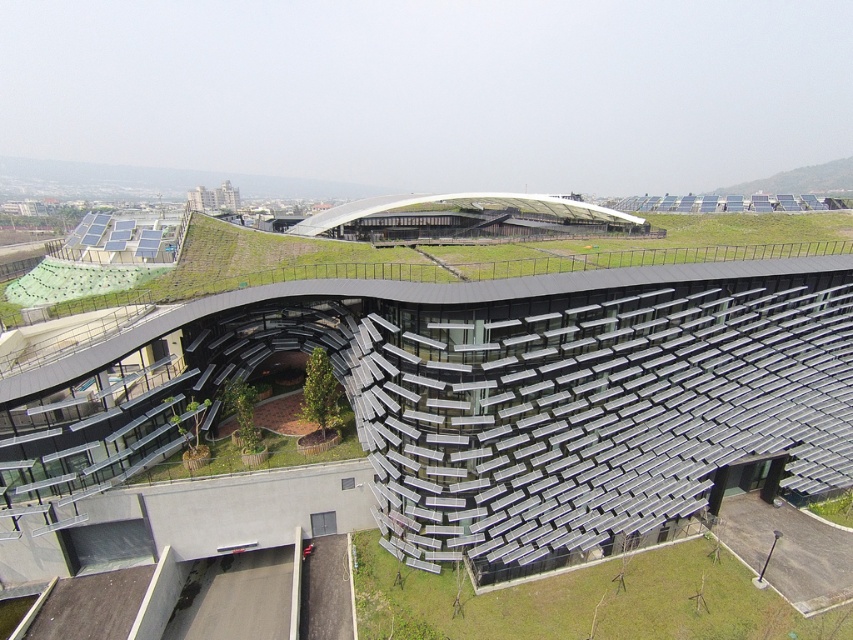
Question: Which point is closer to the camera?

Choices:
 (A) green grass at lower center
 (B) metallic solar panels at center

Answer: (B)

Question: Which point is closer to the camera?

Choices:
 (A) green grass at lower center
 (B) metallic solar panels at center

Answer: (B)

Question: Is metallic solar panels at center to the left of green grass at lower center from the viewer's perspective?

Choices:
 (A) no
 (B) yes

Answer: (B)

Question: Is metallic solar panels at center wider than green grass at lower center?

Choices:
 (A) yes
 (B) no

Answer: (A)

Question: Is metallic solar panels at center to the right of green grass at lower center from the viewer's perspective?

Choices:
 (A) no
 (B) yes

Answer: (A)